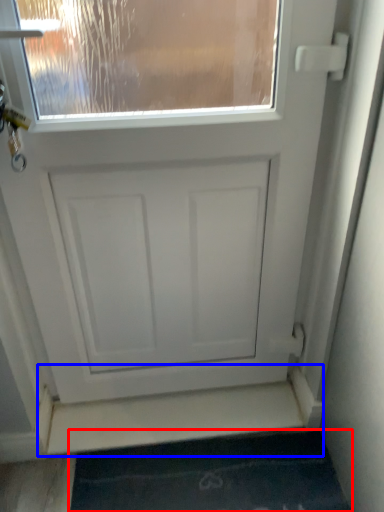
Question: Which object is closer to the camera taking this photo, bath mat (highlighted by a red box) or stairwell (highlighted by a blue box)?

Choices:
 (A) bath mat
 (B) stairwell

Answer: (A)